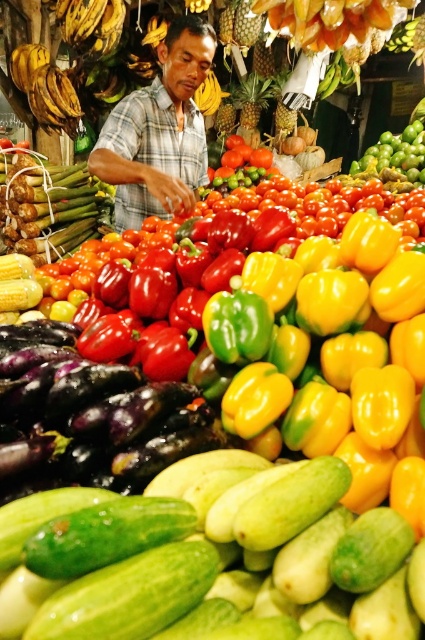
You are a customer at the market and want to pick up the green smooth cucumber at center. Is the cucumber at a reachable height from the plaid fabric vendor at center?

The green smooth cucumber at center is below the plaid fabric vendor at center, so it is at a reachable height.